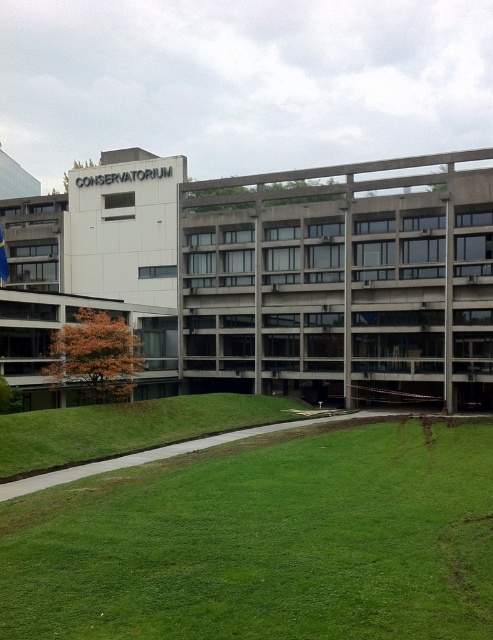
Looking at this image, you are standing at the entrance of the CONSERVATORIUM and want to locate the green grass at lower center. According to the coordinates provided, where exactly should you look to find it?

The green grass at lower center is located at point [265,541].

You are standing in front of the Conservatorium building and want to walk towards the green grass at lower center. Which direction should you go relative to the concrete building at center?

The green grass at lower center is closer to the viewer than the concrete building at center, so you should walk towards the green grass at lower center, which is in front of the concrete building at center.

Looking at this image, you are standing on the green grass at lower center and want to enter the concrete building at center. Which direction should you walk to reach the building?

You should walk upwards towards the concrete building at center since the green grass at lower center is located below it.